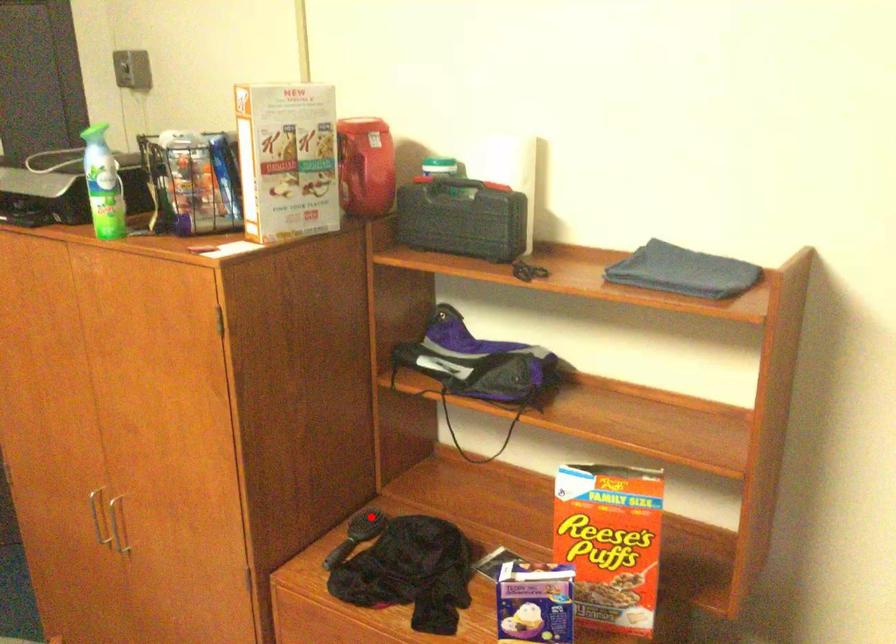
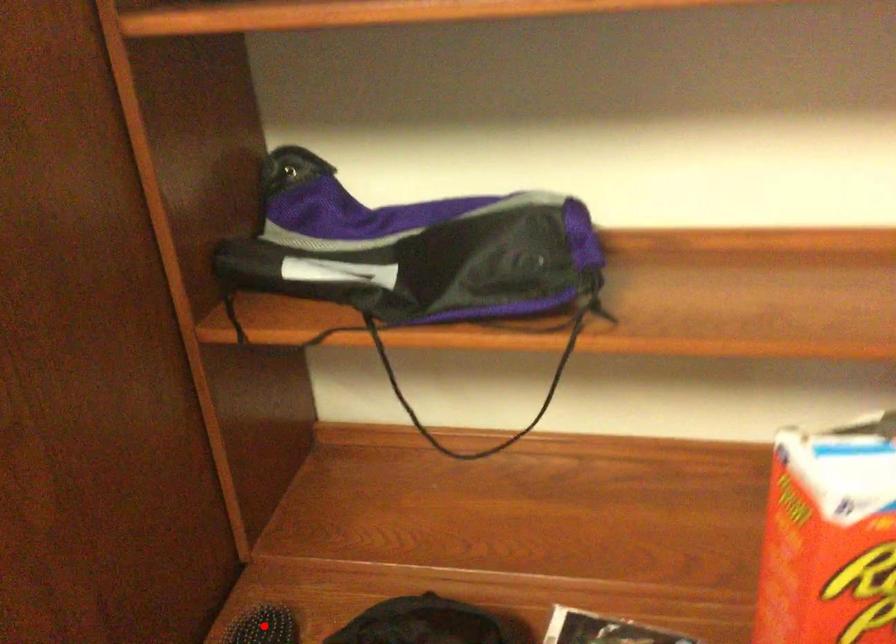
I am providing you with two images of the same scene from different viewpoints. A red point is marked on the first image and another point is marked on the second image. Is the marked point in image1 the same physical position as the marked point in image2?

Yes